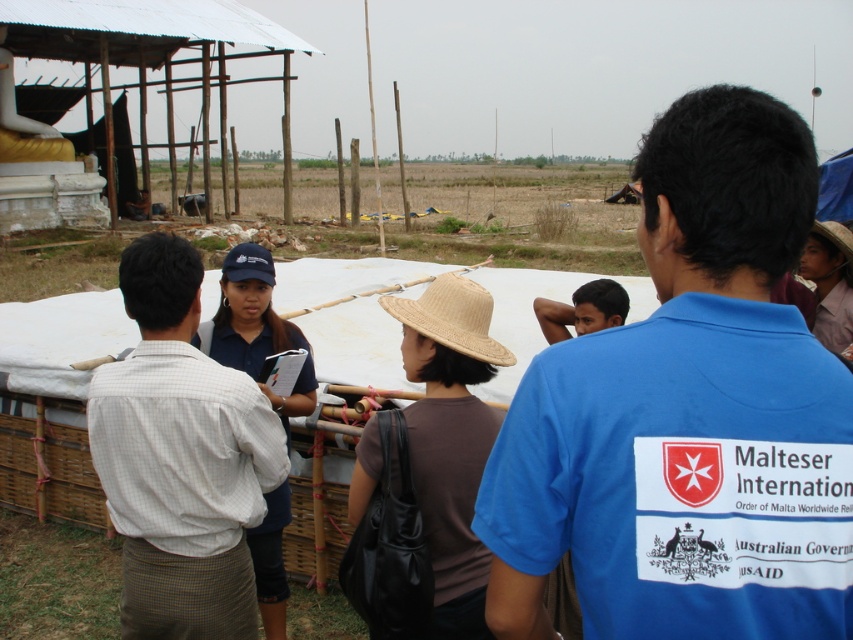
Question: Is blue cotton shirt at center to the left of straw hat at center from the viewer's perspective?

Choices:
 (A) no
 (B) yes

Answer: (B)

Question: Which is nearer to the blue cotton shirt at center?

Choices:
 (A) natural straw hat at center
 (B) brown straw hat at center
 (C) straw hat at center

Answer: (A)

Question: Based on their relative distances, which object is farther from the light brown checkered shirt at center?

Choices:
 (A) blue cotton shirt at center
 (B) tan straw hat at center
 (C) natural straw hat at center
 (D) brown straw hat at center

Answer: (D)

Question: Which object appears closest to the camera in this image?

Choices:
 (A) light brown checkered shirt at center
 (B) tan straw hat at center

Answer: (A)

Question: Can you confirm if light brown checkered shirt at center is bigger than brown straw hat at center?

Choices:
 (A) no
 (B) yes

Answer: (B)

Question: Does light brown checkered shirt at center appear on the right side of natural straw hat at center?

Choices:
 (A) yes
 (B) no

Answer: (A)